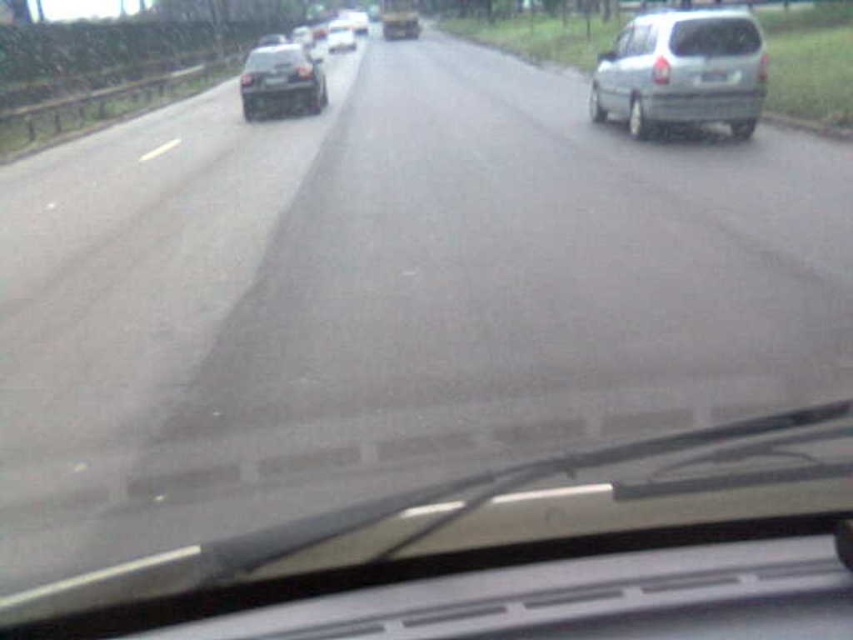
Between point (717, 22) and point (721, 76), which one is positioned behind?

Positioned behind is point (721, 76).

Does point (720, 54) come in front of point (717, 84)?

Yes, point (720, 54) is in front of point (717, 84).

Locate an element on the screen. Image resolution: width=853 pixels, height=640 pixels. transparent glass windshield at center is located at coordinates (714, 36).

Can you confirm if white matte van at right is shorter than glossy black car at center?

No.

Between white matte van at right and glossy black car at center, which one appears on the left side from the viewer's perspective?

glossy black car at center

Find the location of a particular element. white matte van at right is located at coordinates [682, 72].

You are a GUI agent. You are given a task and a screenshot of the screen. Output one action in this format:
    pyautogui.click(x=<x>, y=<y>)
    Task: Click on the white matte van at right
    The width and height of the screenshot is (853, 640).
    Given the screenshot: What is the action you would take?
    pyautogui.click(x=682, y=72)

Is point (724, 93) positioned before point (720, 28)?

No, it is not.

You are a GUI agent. You are given a task and a screenshot of the screen. Output one action in this format:
    pyautogui.click(x=<x>, y=<y>)
    Task: Click on the white matte van at right
    The height and width of the screenshot is (640, 853).
    Given the screenshot: What is the action you would take?
    pyautogui.click(x=682, y=72)